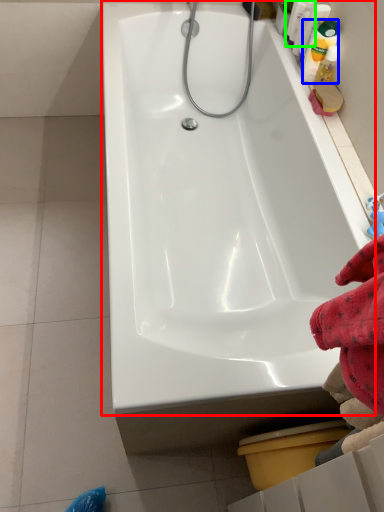
Question: Estimate the real-world distances between objects in this image. Which object is farther from bathtub (highlighted by a red box), cleaning product (highlighted by a blue box) or cleaning product (highlighted by a green box)?

Choices:
 (A) cleaning product
 (B) cleaning product

Answer: (B)